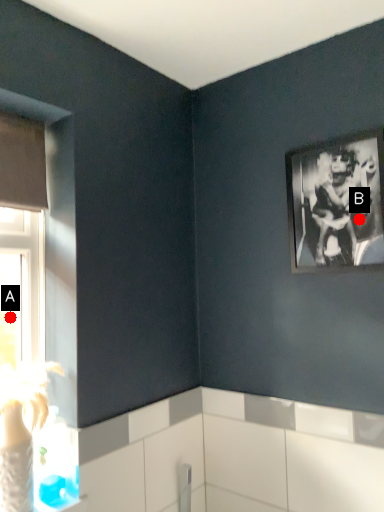
Question: Two points are circled on the image, labeled by A and B beside each circle. Which point is further to the camera?

Choices:
 (A) A is further
 (B) B is further

Answer: (A)